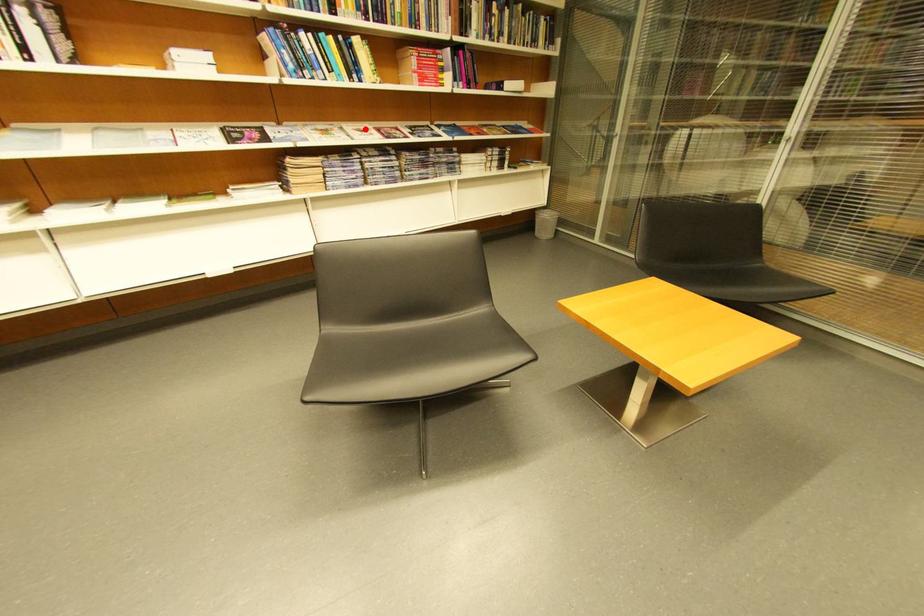
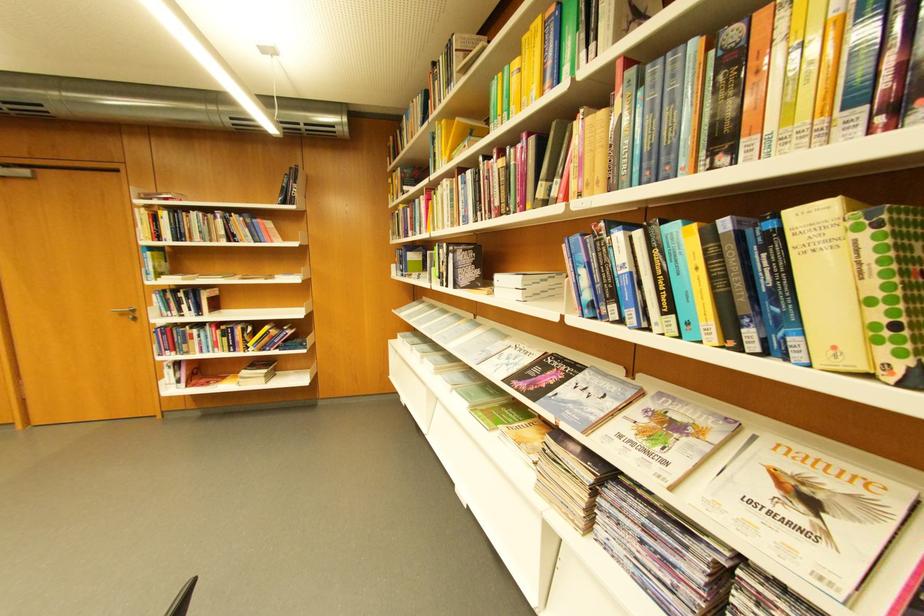
Where in the second image is the point corresponding to the highlighted location from the first image?

(800, 469)